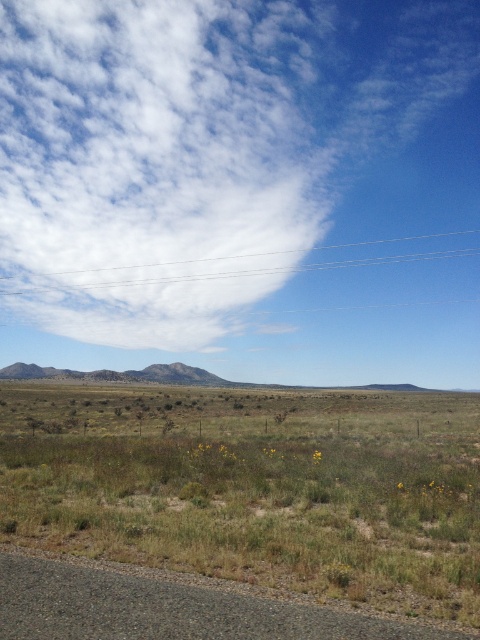
Question: Which point is farther from the camera taking this photo?

Choices:
 (A) (242, 100)
 (B) (442, 451)

Answer: (A)

Question: Which object is closer to the camera taking this photo?

Choices:
 (A) white fluffy cloud at upper center
 (B) green grass at lower left

Answer: (B)

Question: Is white fluffy cloud at upper center wider than green grass at lower left?

Choices:
 (A) yes
 (B) no

Answer: (A)

Question: Is white fluffy cloud at upper center below green grass at lower left?

Choices:
 (A) yes
 (B) no

Answer: (B)

Question: Is white fluffy cloud at upper center further to the viewer compared to green grass at lower left?

Choices:
 (A) no
 (B) yes

Answer: (B)